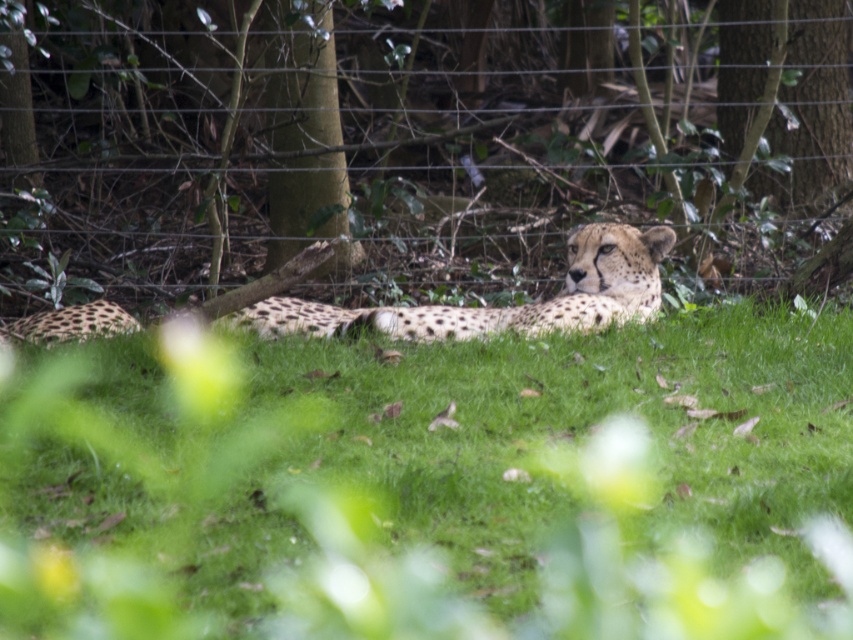
Question: Considering the relative positions of green grassy at center and wire mesh at center in the image provided, where is green grassy at center located with respect to wire mesh at center?

Choices:
 (A) above
 (B) below

Answer: (B)

Question: Which point is closer to the camera?

Choices:
 (A) (773, 488)
 (B) (256, 324)
 (C) (808, 152)

Answer: (A)

Question: Can you confirm if green grassy at center is thinner than wire mesh at center?

Choices:
 (A) yes
 (B) no

Answer: (B)

Question: Estimate the real-world distances between objects in this image. Which object is closer to the spotted fur cheetah at center?

Choices:
 (A) wire mesh at center
 (B) green grassy at center

Answer: (B)

Question: Which is farther from the green grassy at center?

Choices:
 (A) wire mesh at center
 (B) spotted fur cheetah at center

Answer: (A)

Question: Is green grassy at center further to the viewer compared to wire mesh at center?

Choices:
 (A) no
 (B) yes

Answer: (A)